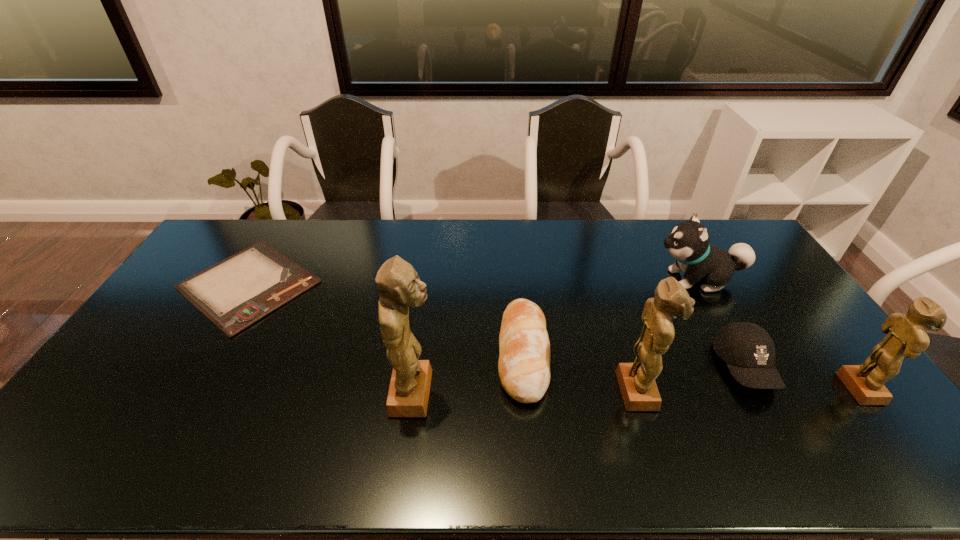
Image resolution: width=960 pixels, height=540 pixels. In order to click on the second object from left to right in this screenshot , I will do `click(398, 284)`.

This screenshot has width=960, height=540. Identify the location of the fourth object from right to left. (639, 391).

Identify the location of the second figurine from right to left. Image resolution: width=960 pixels, height=540 pixels. (639, 391).

The height and width of the screenshot is (540, 960). Identify the location of the shortest figurine. (906, 336).

This screenshot has height=540, width=960. Identify the location of the rightmost figurine. (906, 336).

Find the location of a particular element. the shortest object is located at coordinates (236, 292).

Image resolution: width=960 pixels, height=540 pixels. I want to click on the leftmost object, so click(236, 292).

Find the location of a particular element. Image resolution: width=960 pixels, height=540 pixels. the fourth tallest object is located at coordinates (688, 242).

Locate an element on the screen. the third object from left to right is located at coordinates (524, 361).

Where is `baseball cap`? The image size is (960, 540). baseball cap is located at coordinates (749, 351).